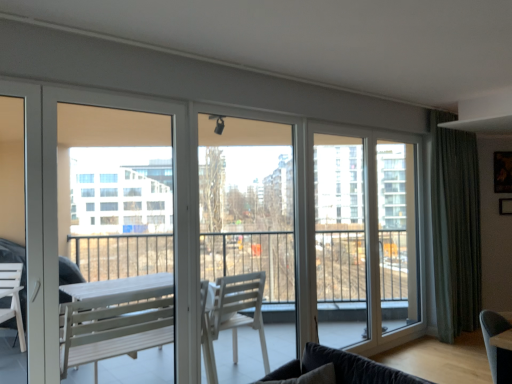
Question: Can you confirm if transparent glass window at center is shorter than white matte screen door at left, arranged as the 1th screen door when viewed from the front?

Choices:
 (A) yes
 (B) no

Answer: (B)

Question: Considering the relative sizes of transparent glass window at center and white matte screen door at left, the 1th screen door viewed from the left, in the image provided, is transparent glass window at center wider than white matte screen door at left, the 1th screen door viewed from the left,?

Choices:
 (A) yes
 (B) no

Answer: (A)

Question: From the image's perspective, is transparent glass window at center below white matte screen door at left, which ranks as the second screen door in back-to-front order?

Choices:
 (A) no
 (B) yes

Answer: (B)

Question: Can white matte screen door at left, the second screen door from the right, be found inside transparent glass window at center?

Choices:
 (A) yes
 (B) no

Answer: (B)

Question: Considering the relative sizes of transparent glass window at center and white matte screen door at left, which ranks as the second screen door in back-to-front order, in the image provided, is transparent glass window at center bigger than white matte screen door at left, which ranks as the second screen door in back-to-front order,?

Choices:
 (A) no
 (B) yes

Answer: (B)

Question: In the image, is transparent glass window at center positioned in front of or behind velvet dark gray studio couch at lower right?

Choices:
 (A) front
 (B) behind

Answer: (B)

Question: Looking at the image, does transparent glass window at center seem bigger or smaller compared to velvet dark gray studio couch at lower right?

Choices:
 (A) big
 (B) small

Answer: (A)

Question: Considering the positions of point (271, 183) and point (357, 380), is point (271, 183) closer or farther from the camera than point (357, 380)?

Choices:
 (A) farther
 (B) closer

Answer: (A)

Question: From a real-world perspective, is transparent glass window at center physically located above or below velvet dark gray studio couch at lower right?

Choices:
 (A) above
 (B) below

Answer: (A)

Question: In terms of width, does white matte screen door at left, arranged as the 1th screen door when viewed from the front, look wider or thinner when compared to transparent glass window at center?

Choices:
 (A) wide
 (B) thin

Answer: (B)

Question: Is white matte screen door at left, the 1th screen door viewed from the left, taller or shorter than transparent glass window at center?

Choices:
 (A) short
 (B) tall

Answer: (A)

Question: In terms of size, does white matte screen door at left, the 1th screen door viewed from the left, appear bigger or smaller than transparent glass window at center?

Choices:
 (A) big
 (B) small

Answer: (B)

Question: From the image's perspective, is white matte screen door at left, which ranks as the second screen door in back-to-front order, located above or below transparent glass window at center?

Choices:
 (A) above
 (B) below

Answer: (A)

Question: Considering their positions, is velvet dark gray studio couch at lower right located in front of or behind white glass screen door at center, which is the second screen door from front to back?

Choices:
 (A) front
 (B) behind

Answer: (A)

Question: From a real-world perspective, is velvet dark gray studio couch at lower right positioned above or below white glass screen door at center, the first screen door when ordered from right to left?

Choices:
 (A) above
 (B) below

Answer: (B)